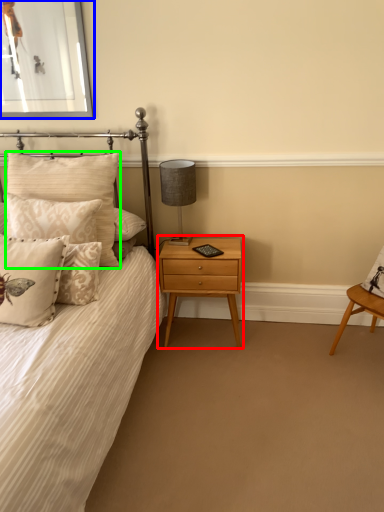
Question: Based on their relative distances, which object is nearer to nightstand (highlighted by a red box)? Choose from picture frame (highlighted by a blue box) and pillow (highlighted by a green box).

Choices:
 (A) picture frame
 (B) pillow

Answer: (B)